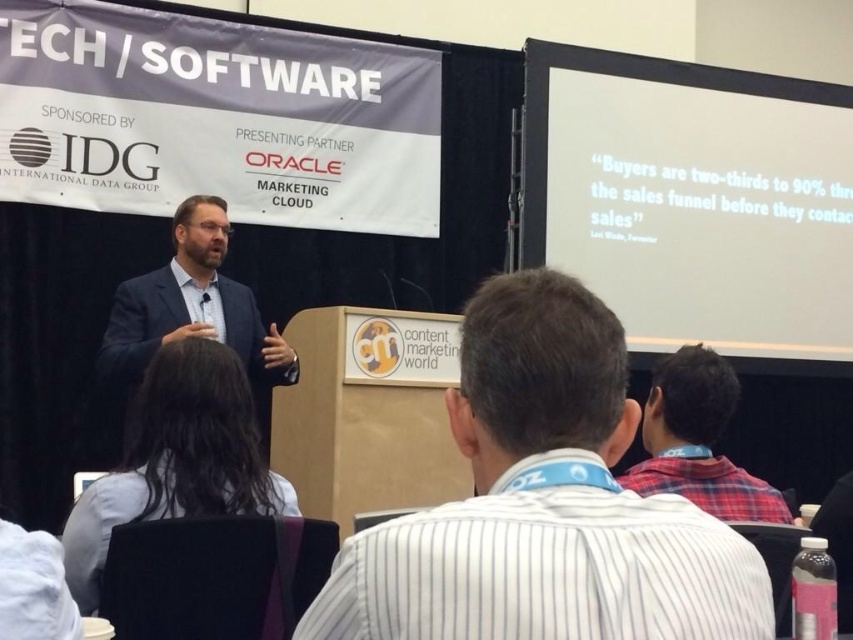
Does light blue shirt at lower left have a lesser width compared to matte blue suit at center?

Yes.

Where is `light blue shirt at lower left`? The image size is (853, 640). light blue shirt at lower left is located at coordinates (177, 460).

The width and height of the screenshot is (853, 640). I want to click on light blue shirt at lower left, so click(x=177, y=460).

Is point (281, 371) less distant than point (666, 413)?

No, (281, 371) is further to viewer.

Who is taller, matte blue suit at center or red plaid shirt at upper right?

matte blue suit at center

Does point (273, 376) come closer to viewer compared to point (666, 355)?

Yes, it is in front of point (666, 355).

The height and width of the screenshot is (640, 853). I want to click on matte blue suit at center, so coord(190,307).

Is white striped shirt at center smaller than matte blue suit at center?

Indeed, white striped shirt at center has a smaller size compared to matte blue suit at center.

How distant is white striped shirt at center from matte blue suit at center?

A distance of 2.52 meters exists between white striped shirt at center and matte blue suit at center.

Is point (538, 467) positioned after point (161, 282)?

No, (538, 467) is closer to viewer.

In order to click on white striped shirt at center in this screenshot , I will do `click(544, 504)`.